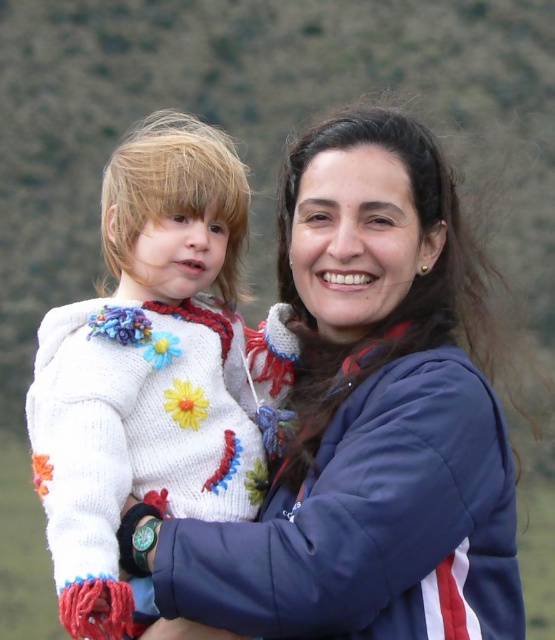
You are a photographer trying to capture both the matte blue jacket at center and the white knitted sweater at left in a single frame. Which object should you focus on first to ensure both are in the frame?

The matte blue jacket at center occupies less space than the white knitted sweater at left, so you should focus on the white knitted sweater at left first to ensure both are captured in the frame.

You are a photographer trying to adjust your camera focus. You have two points to focus on in the image. The first is point (380, 497) and the second is point (184, 433). Which point should you focus on if you want to capture the subject that is closer to the camera?

Point (184, 433) is closer to the camera than point (380, 497), so you should focus on point (184, 433) to capture the subject that is closer to the camera.

Consider the image. You are a photographer trying to adjust the composition of this photo. You want to ensure the matte blue jacket at center and the white knitted sweater at left are both visible. Based on their positions, which one should you focus on first to avoid cropping either out?

The matte blue jacket at center is located below the white knitted sweater at left. To ensure both are visible, focus on the white knitted sweater at left first since it is higher up, allowing you to adjust the frame to include both items without cropping.